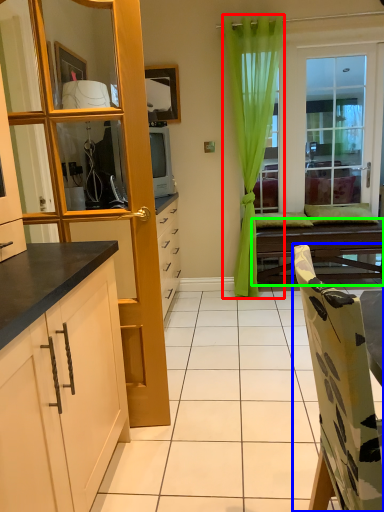
Question: Which object is positioned closest to curtain (highlighted by a red box)? Select from chair (highlighted by a blue box) and table (highlighted by a green box).

Choices:
 (A) chair
 (B) table

Answer: (B)